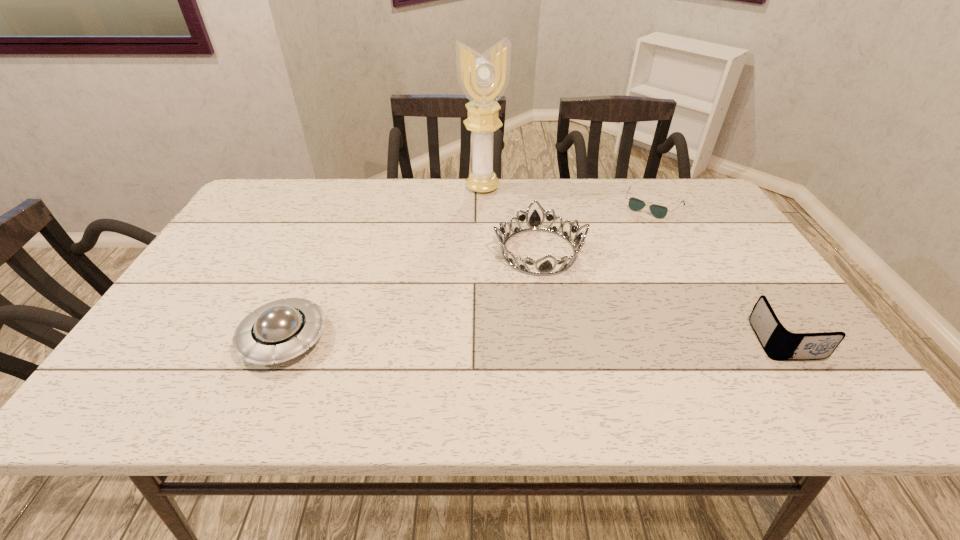
Find the location of a particular element. vacant position located 0.150m on the front-facing side of the tallest object is located at coordinates (500, 223).

The image size is (960, 540). I want to click on vacant space situated 0.130m on the front-facing side of the tallest object, so click(x=498, y=219).

Find the location of `free space located 0.060m on the lenses of the sunglasses`. free space located 0.060m on the lenses of the sunglasses is located at coordinates (636, 228).

Identify the location of blank area located on the lenses of the sunglasses. (636, 228).

Locate an element on the screen. The image size is (960, 540). free region located 0.140m on the lenses of the sunglasses is located at coordinates (627, 242).

The width and height of the screenshot is (960, 540). I want to click on award that is positioned at the far edge, so click(483, 78).

What are the coordinates of `sunglasses that is at the far edge` in the screenshot? It's located at (x=658, y=211).

Find the location of a particular element. saucer present at the near edge is located at coordinates (281, 330).

Where is `wallet present at the near edge`? The width and height of the screenshot is (960, 540). wallet present at the near edge is located at coordinates (779, 344).

This screenshot has width=960, height=540. I want to click on wallet positioned at the right edge, so click(779, 344).